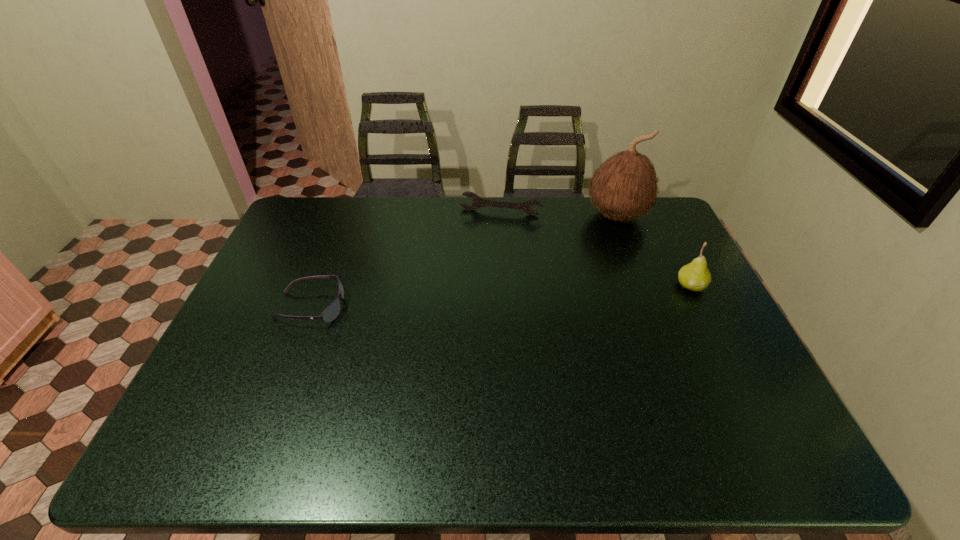
In order to click on free space at the far edge of the desktop in this screenshot , I will do `click(493, 212)`.

In the image, there is a desktop. Where is `vacant space at the near edge`? vacant space at the near edge is located at coordinates (538, 393).

In order to click on vacant space at the left edge of the desktop in this screenshot , I will do click(253, 325).

In the image, there is a desktop. Where is `free space at the right edge`? This screenshot has width=960, height=540. free space at the right edge is located at coordinates (708, 307).

I want to click on free spot at the far left corner of the desktop, so click(x=304, y=227).

You are a GUI agent. You are given a task and a screenshot of the screen. Output one action in this format:
    pyautogui.click(x=<x>, y=<y>)
    Task: Click on the vacant space at the near right corner of the desktop
    
    Given the screenshot: What is the action you would take?
    pyautogui.click(x=746, y=387)

This screenshot has height=540, width=960. Find the location of `free space between the sunglasses and the third shortest object`. free space between the sunglasses and the third shortest object is located at coordinates (500, 296).

Where is `free area in between the pear and the second shortest object`? free area in between the pear and the second shortest object is located at coordinates (595, 249).

I want to click on blank region between the coconut and the sunglasses, so click(x=464, y=261).

The width and height of the screenshot is (960, 540). I want to click on empty location between the third shortest object and the sunglasses, so click(x=500, y=296).